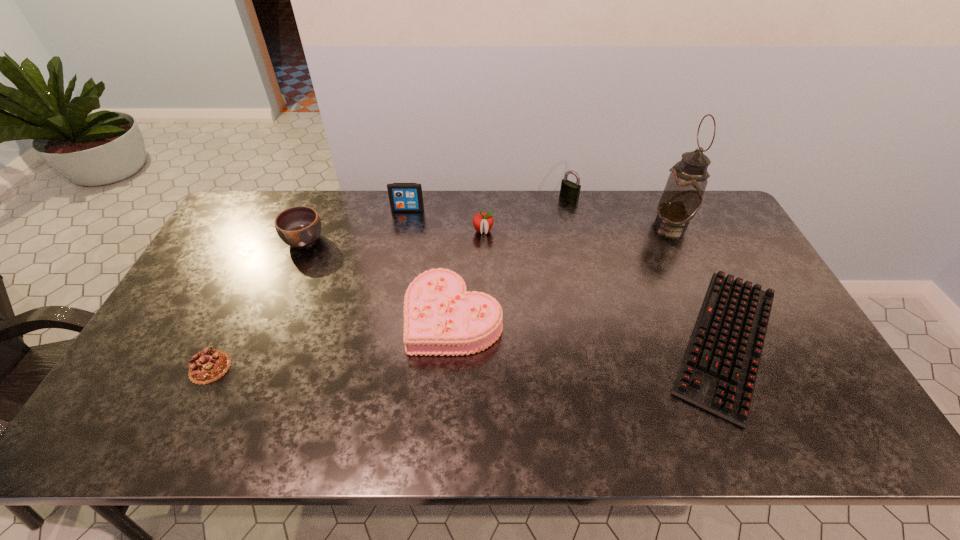
At what (x,y) coordinates should I click in order to perform the action: click on free space at the right edge. Please return your answer as a coordinate pair (x, y). Looking at the image, I should click on (771, 320).

Where is `vacant space at the near right corner`? Image resolution: width=960 pixels, height=540 pixels. vacant space at the near right corner is located at coordinates [x=839, y=415].

Identify the location of free point between the apple and the tallest object. (578, 227).

You are a GUI agent. You are given a task and a screenshot of the screen. Output one action in this format:
    pyautogui.click(x=<x>, y=<y>)
    Task: Click on the unoccupied position between the bowl and the shortest object
    Image resolution: width=960 pixels, height=540 pixels.
    Given the screenshot: What is the action you would take?
    pyautogui.click(x=516, y=291)

Where is `free space between the cake and the sixth object from left to right`? This screenshot has height=540, width=960. free space between the cake and the sixth object from left to right is located at coordinates (512, 257).

The image size is (960, 540). I want to click on unoccupied position between the cake and the iPod, so click(431, 263).

Image resolution: width=960 pixels, height=540 pixels. Identify the location of vacant space that's between the cake and the oil lamp. (563, 269).

This screenshot has height=540, width=960. I want to click on free space between the iPod and the second shortest object, so click(309, 288).

You are a GUI agent. You are given a task and a screenshot of the screen. Output one action in this format:
    pyautogui.click(x=<x>, y=<y>)
    Task: Click on the free spot between the iPod and the cake
    The image size is (960, 540).
    Given the screenshot: What is the action you would take?
    pyautogui.click(x=431, y=263)

Find the location of a particular element. vacant space that's between the cake and the iPod is located at coordinates (431, 263).